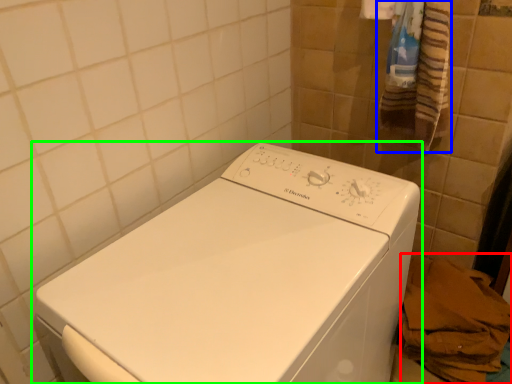
Question: Based on their relative distances, which object is farther from material (highlighted by a red box)? Choose from bath towel (highlighted by a blue box) and washing machine (highlighted by a green box).

Choices:
 (A) bath towel
 (B) washing machine

Answer: (A)